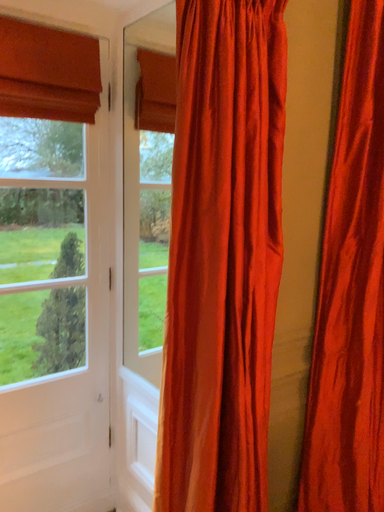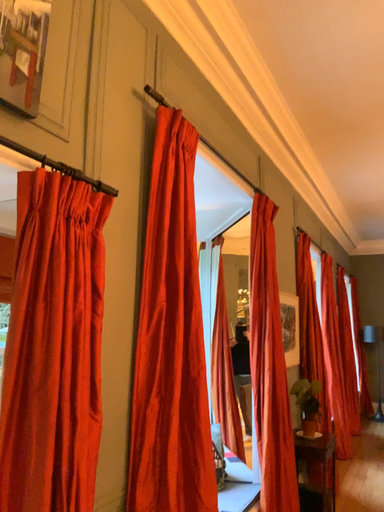
Question: Which way did the camera rotate in the video?

Choices:
 (A) rotated right
 (B) rotated left

Answer: (A)